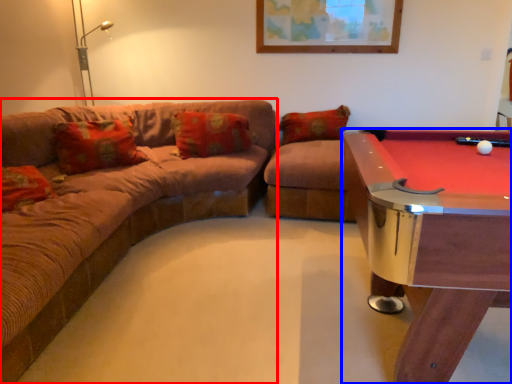
Question: Which point is closer to the camera, studio couch (highlighted by a red box) or billiard table (highlighted by a blue box)?

Choices:
 (A) studio couch
 (B) billiard table

Answer: (A)